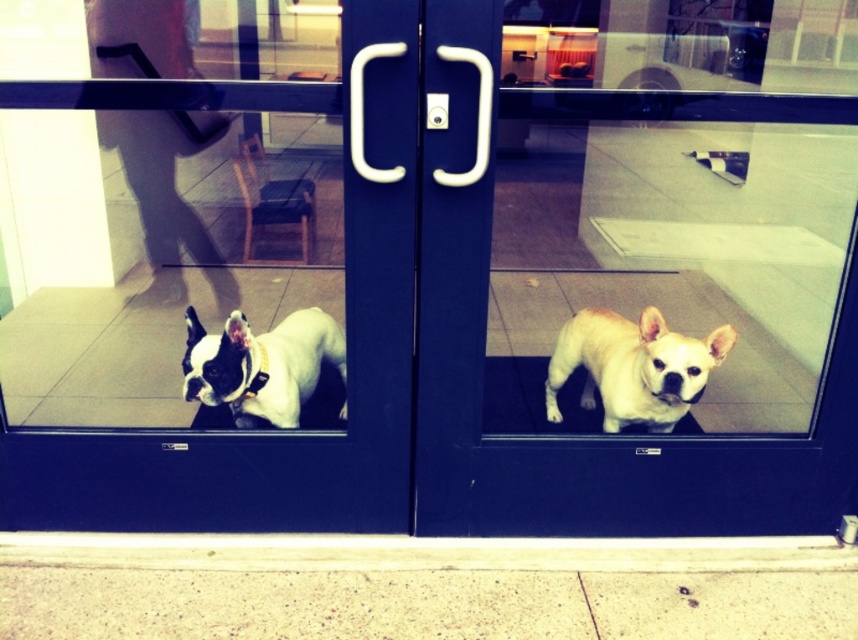
You are standing outside the glass door with blue frames and want to enter the building. There is a white glossy screen door at left near point (273,435). Which direction should you move to reach the door?

The white glossy screen door at left is located at point (273,435), so you should move towards the left side of the door to reach it.

You are a delivery person approaching the glass door with blue frames. You see the white glossy dog at center and the light beige fur at center through the door. Which dog is closer to your left side as you face the door?

The white glossy dog at center is closer to your left side as you face the door because it is positioned to the left of the light beige fur at center.

You are standing outside the glass door and want to take a photo of the white matte dog at left without including the white glossy screen door at left in the frame. Is it possible to do so by moving closer to the door?

The white glossy screen door at left is closer to the viewer than the white matte dog at left. Moving closer to the door would bring the screen door into focus more prominently, making it harder to exclude it from the photo. Therefore, it might not be possible to take the photo without including the white glossy screen door at left.